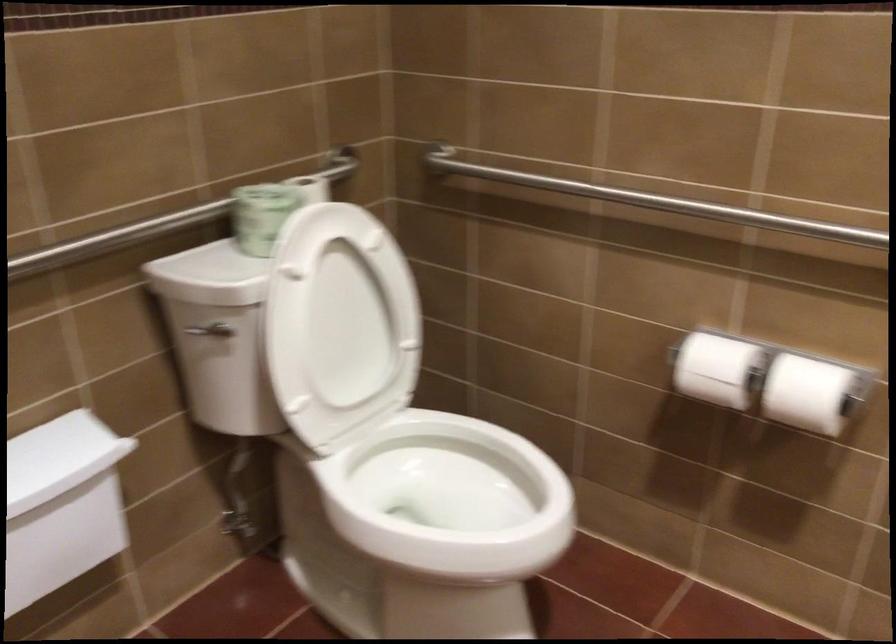
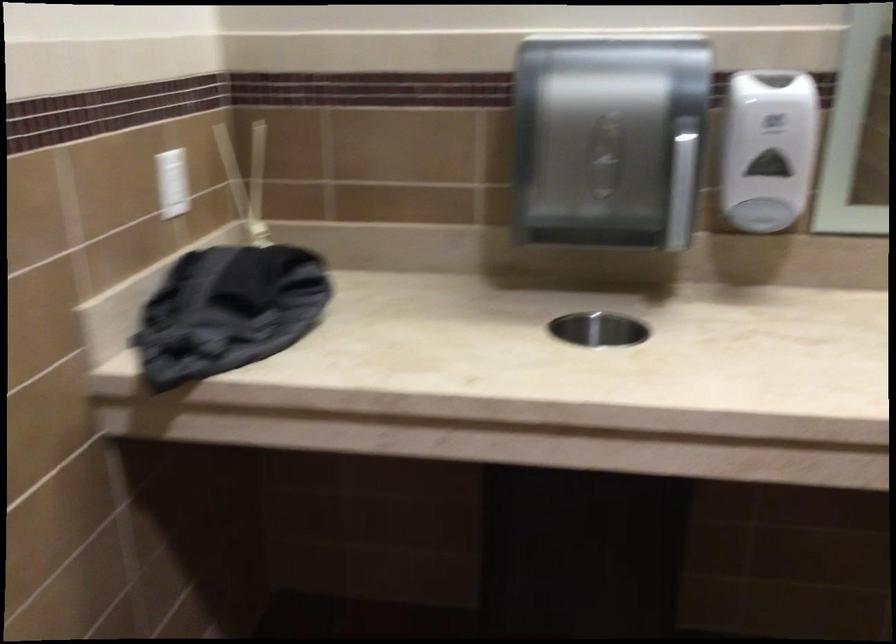
How did the camera likely rotate?

The camera rotated toward right-down.